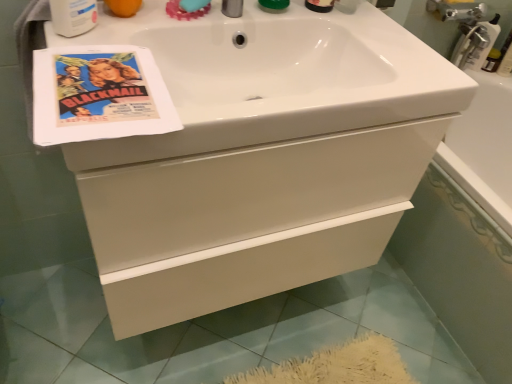
Where is `vacant space behind vintage paper flyer at upper left`? This screenshot has height=384, width=512. vacant space behind vintage paper flyer at upper left is located at coordinates (121, 34).